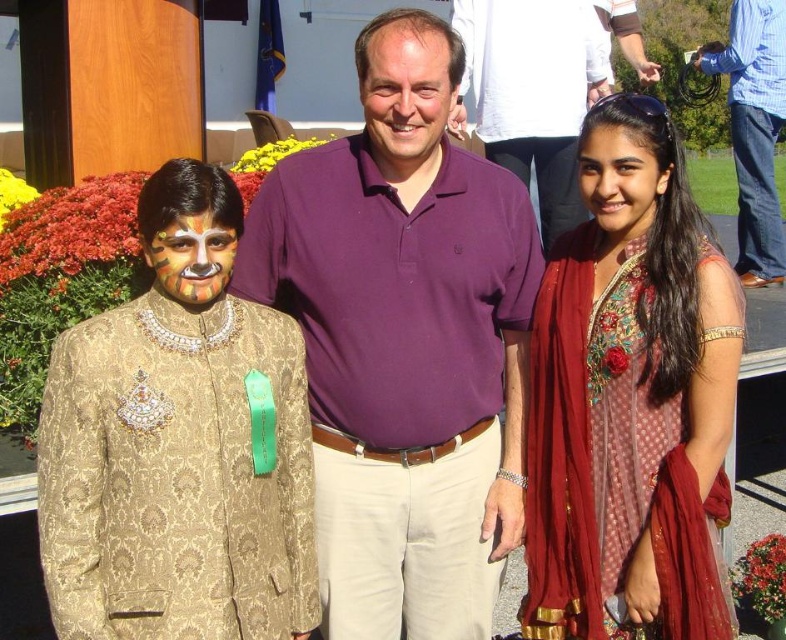
Question: Is blue denim jeans at right bigger than purple smooth shirt at center?

Choices:
 (A) no
 (B) yes

Answer: (A)

Question: In this image, where is matte red dress at right located relative to purple smooth shirt at center?

Choices:
 (A) below
 (B) above

Answer: (A)

Question: Which point is closer to the camera?

Choices:
 (A) (193, 440)
 (B) (531, 86)
 (C) (403, 68)
 (D) (215, 264)

Answer: (A)

Question: Which point is closer to the camera?

Choices:
 (A) (562, 131)
 (B) (173, 241)
 (C) (717, 508)

Answer: (B)

Question: Based on their relative distances, which object is nearer to the smooth skin face at center?

Choices:
 (A) purple cotton polo shirt at center
 (B) blue denim jeans at right

Answer: (A)

Question: Does matte red dress at right have a smaller size compared to purple cotton shirt at center?

Choices:
 (A) no
 (B) yes

Answer: (B)